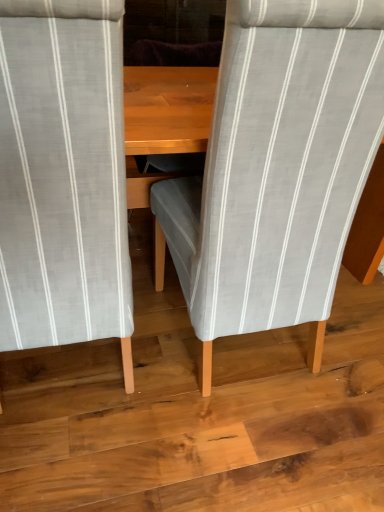
Question: Does wooden floor at center appear on the left side of light gray striped fabric chair at center, the second chair when ordered from right to left?

Choices:
 (A) no
 (B) yes

Answer: (A)

Question: Is wooden floor at center positioned far away from light gray striped fabric chair at center, the second chair when ordered from right to left?

Choices:
 (A) yes
 (B) no

Answer: (B)

Question: From a real-world perspective, is wooden floor at center physically above light gray striped fabric chair at center, which is the first chair in left-to-right order?

Choices:
 (A) no
 (B) yes

Answer: (A)

Question: Would you say light gray striped fabric chair at center, which is the first chair in left-to-right order, is part of wooden floor at center's contents?

Choices:
 (A) no
 (B) yes

Answer: (A)

Question: From the image's perspective, would you say wooden floor at center is positioned over light gray striped fabric chair at center, which is the first chair in left-to-right order?

Choices:
 (A) yes
 (B) no

Answer: (B)

Question: Can you confirm if wooden floor at center is bigger than light gray striped fabric chair at center, which is the first chair in left-to-right order?

Choices:
 (A) no
 (B) yes

Answer: (A)

Question: Can you confirm if light gray striped fabric chair at center, which is the first chair in left-to-right order, is positioned to the right of wooden floor at center?

Choices:
 (A) yes
 (B) no

Answer: (B)

Question: Can you confirm if light gray striped fabric chair at center, the second chair when ordered from right to left, is positioned to the left of wooden floor at center?

Choices:
 (A) yes
 (B) no

Answer: (A)

Question: Is light gray striped fabric chair at center, the second chair when ordered from right to left, taller than wooden floor at center?

Choices:
 (A) no
 (B) yes

Answer: (B)

Question: Is wooden floor at center at the back of light gray striped fabric chair at center, which is the first chair in left-to-right order?

Choices:
 (A) yes
 (B) no

Answer: (B)

Question: Considering the relative sizes of light gray striped fabric chair at center, the second chair when ordered from right to left, and wooden floor at center in the image provided, is light gray striped fabric chair at center, the second chair when ordered from right to left, thinner than wooden floor at center?

Choices:
 (A) yes
 (B) no

Answer: (A)

Question: From a real-world perspective, is wooden floor at center on light gray striped fabric chair at center, placed as the 2th chair when sorted from left to right?

Choices:
 (A) yes
 (B) no

Answer: (B)